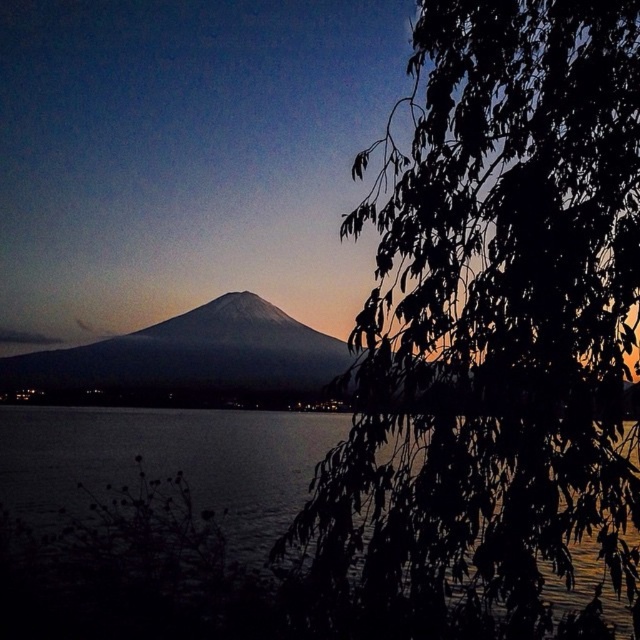
Is green leafy branch at right wider than dark water at lower left?

No, green leafy branch at right is not wider than dark water at lower left.

How much distance is there between green leafy branch at right and dark water at lower left?

green leafy branch at right is 10.64 meters away from dark water at lower left.

Who is more distant from viewer, (417,216) or (260,500)?

Point (260,500)

Identify the location of green leafy branch at right. click(x=493, y=324).

Does dark water at lower left appear on the right side of gray matte mountain at center?

In fact, dark water at lower left is to the left of gray matte mountain at center.

Where is `dark water at lower left`? This screenshot has width=640, height=640. dark water at lower left is located at coordinates click(168, 458).

Describe the element at coordinates (493, 324) in the screenshot. I see `green leafy branch at right` at that location.

Does green leafy branch at right have a larger size compared to gray matte mountain at center?

No.

Find the location of a particular element. The image size is (640, 640). green leafy branch at right is located at coordinates (493, 324).